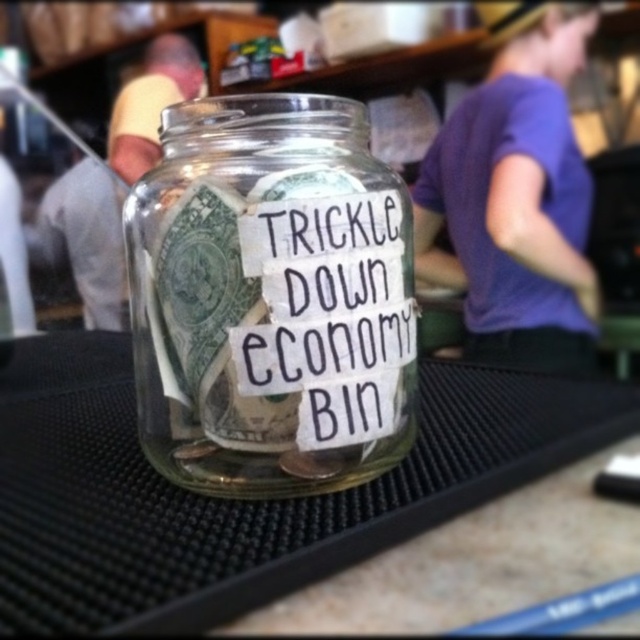
Is point (332, 364) behind point (340, 426)?

No, it is in front of (340, 426).

Is point (348, 186) behind point (385, 300)?

No, (348, 186) is closer to viewer.

Where is `transparent glass jar at center`? This screenshot has height=640, width=640. transparent glass jar at center is located at coordinates (269, 298).